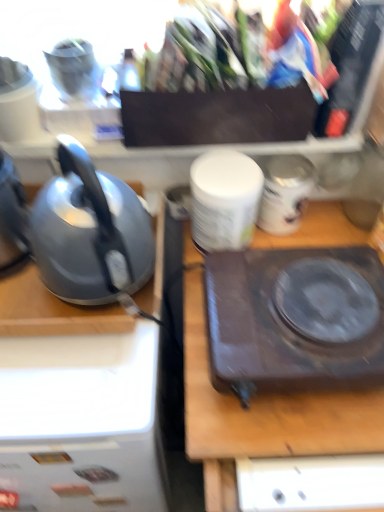
Question: From the image's perspective, would you say dark brown plastic hot plate at center is shown under white matte container at center?

Choices:
 (A) yes
 (B) no

Answer: (A)

Question: From a real-world perspective, is dark brown plastic hot plate at center on white matte container at center?

Choices:
 (A) yes
 (B) no

Answer: (B)

Question: Does dark brown plastic hot plate at center have a lesser width compared to white matte container at center?

Choices:
 (A) yes
 (B) no

Answer: (B)

Question: Can you confirm if dark brown plastic hot plate at center is bigger than white matte container at center?

Choices:
 (A) no
 (B) yes

Answer: (B)

Question: From a real-world perspective, is dark brown plastic hot plate at center below white matte container at center?

Choices:
 (A) no
 (B) yes

Answer: (B)

Question: Considering the relative sizes of dark brown plastic hot plate at center and white matte container at center in the image provided, is dark brown plastic hot plate at center smaller than white matte container at center?

Choices:
 (A) no
 (B) yes

Answer: (A)

Question: Is satin grey kettle at left wider than white glossy jar at center?

Choices:
 (A) yes
 (B) no

Answer: (A)

Question: Does satin grey kettle at left come behind white glossy jar at center?

Choices:
 (A) no
 (B) yes

Answer: (A)

Question: Is satin grey kettle at left smaller than white glossy jar at center?

Choices:
 (A) yes
 (B) no

Answer: (B)

Question: From a real-world perspective, is satin grey kettle at left located beneath white glossy jar at center?

Choices:
 (A) yes
 (B) no

Answer: (B)

Question: Does satin grey kettle at left appear on the left side of white glossy jar at center?

Choices:
 (A) yes
 (B) no

Answer: (A)

Question: Can we say satin grey kettle at left lies outside white glossy jar at center?

Choices:
 (A) no
 (B) yes

Answer: (B)

Question: Can you confirm if dark brown plastic hot plate at center is bigger than satin grey kettle at left?

Choices:
 (A) no
 (B) yes

Answer: (A)